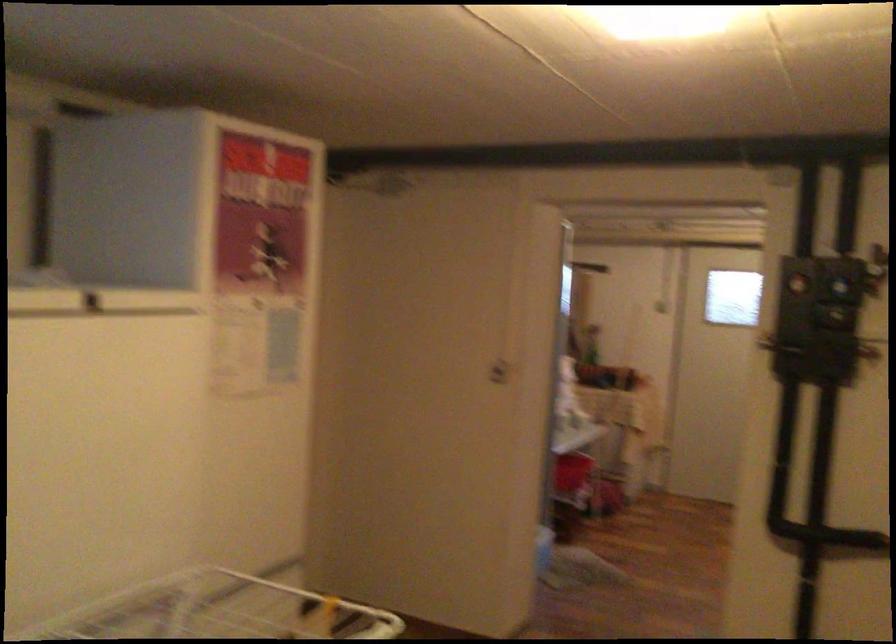
Find where to pull the refrigerator door handle. Please return your answer as a coordinate pair (x, y).

(99, 301)